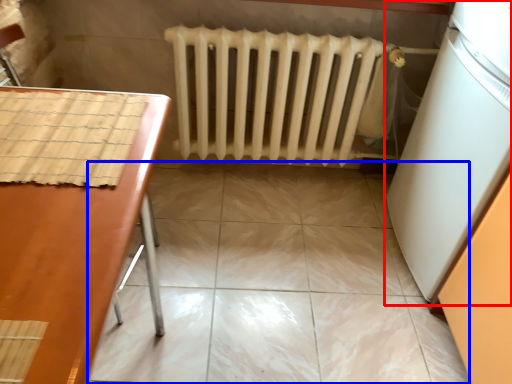
Question: Which object is closer to the camera taking this photo, appliance (highlighted by a red box) or ceramic tile (highlighted by a blue box)?

Choices:
 (A) appliance
 (B) ceramic tile

Answer: (A)